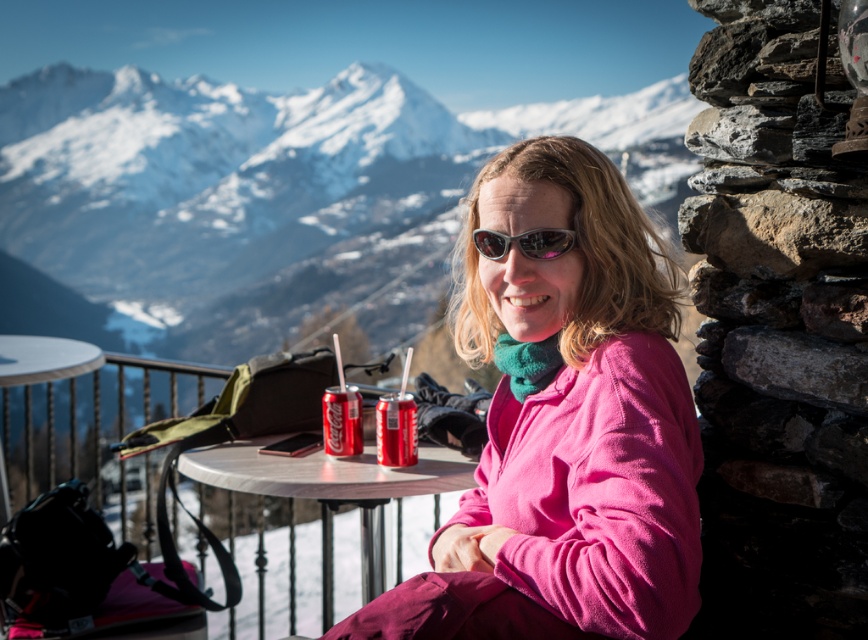
Does pink fleece jacket at center have a greater height compared to red matte can at center?

Result: Correct, pink fleece jacket at center is much taller as red matte can at center.

What do you see at coordinates (564, 424) in the screenshot? This screenshot has height=640, width=868. I see `pink fleece jacket at center` at bounding box center [564, 424].

What do you see at coordinates (564, 424) in the screenshot? The width and height of the screenshot is (868, 640). I see `pink fleece jacket at center` at bounding box center [564, 424].

Identify the location of pink fleece jacket at center. The height and width of the screenshot is (640, 868). click(x=564, y=424).

Which is in front, point (479, 317) or point (275, 472)?

Point (479, 317) is in front.

Identify the location of pink fleece jacket at center. (564, 424).

At what (x,y) coordinates should I click in order to perform the action: click on pink fleece jacket at center. Please return your answer as a coordinate pair (x, y). This screenshot has width=868, height=640. Looking at the image, I should click on (564, 424).

Identify the location of pink fleece jacket at center. The width and height of the screenshot is (868, 640). (564, 424).

In the scene shown: Measure the distance between pink fleece jacket at center and red matte coca-cola can at center.

pink fleece jacket at center is 33.83 inches away from red matte coca-cola can at center.

Does pink fleece jacket at center appear on the left side of red matte coca-cola can at center?

In fact, pink fleece jacket at center is to the right of red matte coca-cola can at center.

Image resolution: width=868 pixels, height=640 pixels. What are the coordinates of `pink fleece jacket at center` in the screenshot? It's located at click(564, 424).

Identify the location of pink fleece jacket at center. Image resolution: width=868 pixels, height=640 pixels. (564, 424).